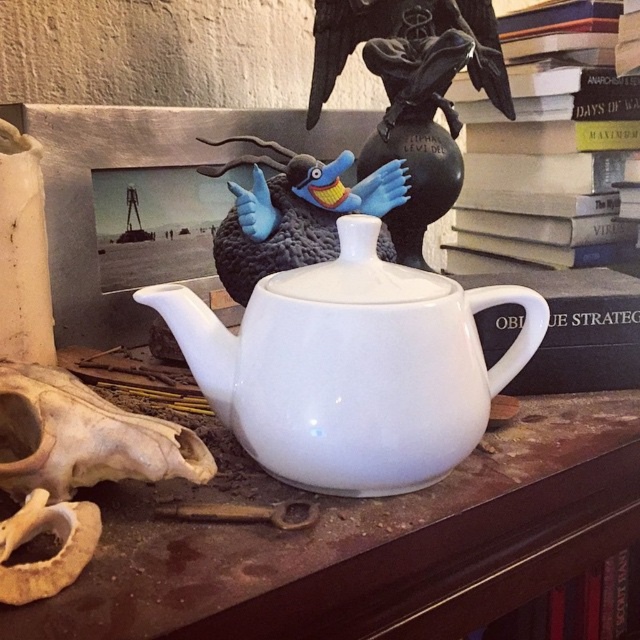
You are organizing a display and want to place the blue plush bird at center and the black matte bird at upper center on a shelf. Based on their heights, which bird should you place on the lower shelf to ensure both are visible?

The blue plush bird at center is shorter than the black matte bird at upper center, so place the blue plush bird at center on the lower shelf to ensure both are visible.

What is located at the coordinates point (292, 212)?

The blue plush bird at center is located at point (292, 212).